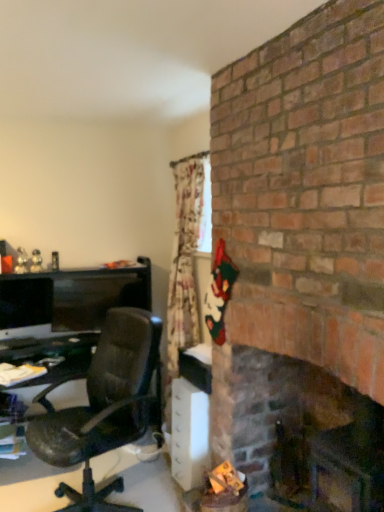
Question: Is the position of white plastic/file cabinet at lower center more distant than that of dark brown wood fireplace at right?

Choices:
 (A) yes
 (B) no

Answer: (A)

Question: From a real-world perspective, is white plastic/file cabinet at lower center positioned under dark brown wood fireplace at right based on gravity?

Choices:
 (A) no
 (B) yes

Answer: (B)

Question: Is the depth of white plastic/file cabinet at lower center less than that of dark brown wood fireplace at right?

Choices:
 (A) no
 (B) yes

Answer: (A)

Question: Can you confirm if white plastic/file cabinet at lower center is shorter than dark brown wood fireplace at right?

Choices:
 (A) yes
 (B) no

Answer: (A)

Question: Is white plastic/file cabinet at lower center to the right of dark brown wood fireplace at right from the viewer's perspective?

Choices:
 (A) no
 (B) yes

Answer: (A)

Question: Is white plastic/file cabinet at lower center taller than dark brown wood fireplace at right?

Choices:
 (A) no
 (B) yes

Answer: (A)

Question: Does matte black monitor at left lie in front of dark brown wood fireplace at right?

Choices:
 (A) yes
 (B) no

Answer: (B)

Question: Does matte black monitor at left have a greater width compared to dark brown wood fireplace at right?

Choices:
 (A) yes
 (B) no

Answer: (B)

Question: Does matte black monitor at left have a lesser width compared to dark brown wood fireplace at right?

Choices:
 (A) no
 (B) yes

Answer: (B)

Question: Is matte black monitor at left not close to dark brown wood fireplace at right?

Choices:
 (A) no
 (B) yes

Answer: (B)

Question: Considering the relative sizes of matte black monitor at left and dark brown wood fireplace at right in the image provided, is matte black monitor at left shorter than dark brown wood fireplace at right?

Choices:
 (A) no
 (B) yes

Answer: (B)

Question: From the image's perspective, does matte black monitor at left appear lower than dark brown wood fireplace at right?

Choices:
 (A) no
 (B) yes

Answer: (A)

Question: From the image's perspective, is dark brown wood fireplace at right beneath matte black monitor at left?

Choices:
 (A) no
 (B) yes

Answer: (B)